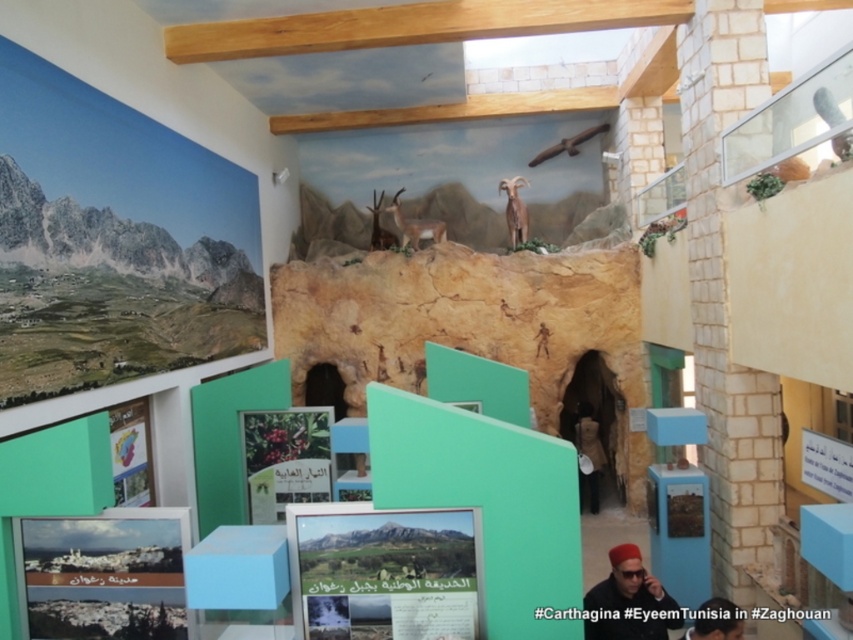
You are a museum guide explaining the exhibit to visitors. You point to the shiny brown horn at upper center and the brown textured antelope at center. Which of these two items is smaller in size?

The shiny brown horn at upper center is smaller in size compared to the brown textured antelope at center.

You are standing in the exhibit space and want to touch the point at coordinate point (724, 611). Can you reach it without moving your position?

The point at coordinate point (724, 611) is 3.72 meters away from the viewer, so you cannot reach it without moving your position because it is too far.